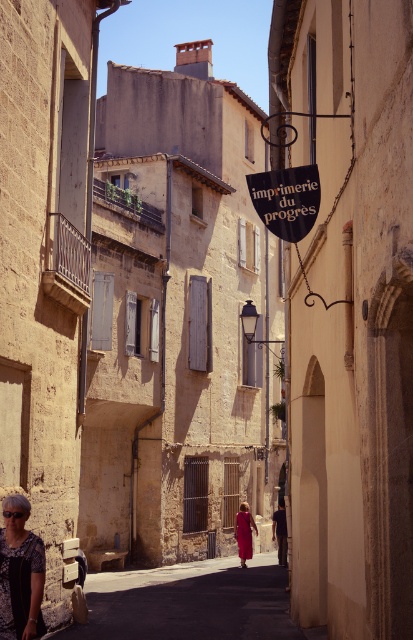
Question: Which point is closer to the camera taking this photo?

Choices:
 (A) (x=310, y=164)
 (B) (x=147, y=573)

Answer: (A)

Question: Can you confirm if matte black shirt at lower left is positioned above black plastic sign at center?

Choices:
 (A) no
 (B) yes

Answer: (A)

Question: Which of these objects is positioned farthest from the black plastic sign at center?

Choices:
 (A) smooth concrete alley at center
 (B) matte black shirt at lower left

Answer: (A)

Question: Does smooth concrete alley at center have a lesser width compared to matte black shirt at lower left?

Choices:
 (A) yes
 (B) no

Answer: (B)

Question: Estimate the real-world distances between objects in this image. Which object is farther from the matte black shirt at lower left?

Choices:
 (A) black plastic sign at center
 (B) matte red dress at center
 (C) smooth concrete alley at center

Answer: (B)

Question: Where is smooth concrete alley at center located in relation to matte black shirt at lower left in the image?

Choices:
 (A) right
 (B) left

Answer: (A)